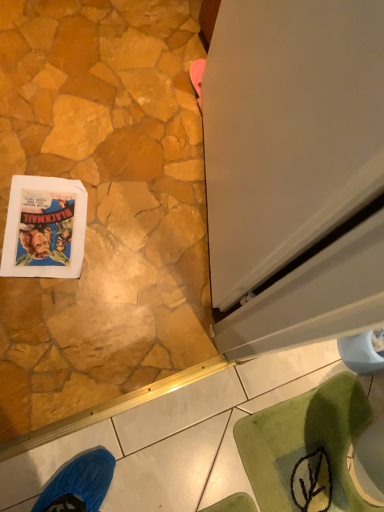
Question: Based on their positions, is white glossy screen door at right located to the left or right of matte paper comic book at lower left?

Choices:
 (A) right
 (B) left

Answer: (A)

Question: Considering the positions of white glossy screen door at right and matte paper comic book at lower left in the image, is white glossy screen door at right bigger or smaller than matte paper comic book at lower left?

Choices:
 (A) small
 (B) big

Answer: (B)

Question: In terms of width, does white glossy screen door at right look wider or thinner when compared to matte paper comic book at lower left?

Choices:
 (A) wide
 (B) thin

Answer: (B)

Question: From a real-world perspective, is matte paper comic book at lower left positioned above or below white glossy screen door at right?

Choices:
 (A) below
 (B) above

Answer: (A)

Question: Considering their positions, is matte paper comic book at lower left located in front of or behind white glossy screen door at right?

Choices:
 (A) behind
 (B) front

Answer: (A)

Question: From their relative heights in the image, would you say matte paper comic book at lower left is taller or shorter than white glossy screen door at right?

Choices:
 (A) tall
 (B) short

Answer: (B)

Question: Is matte paper comic book at lower left inside or outside of white glossy screen door at right?

Choices:
 (A) inside
 (B) outside

Answer: (B)